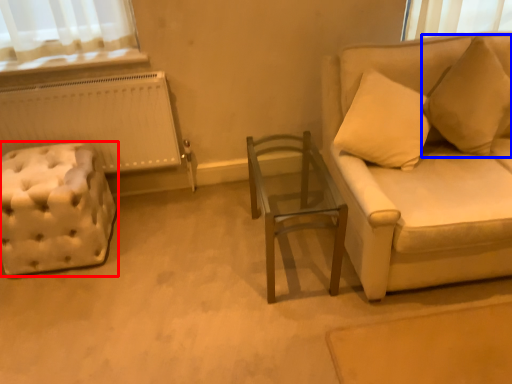
Question: Which object is further to the camera taking this photo, furniture (highlighted by a red box) or pillow (highlighted by a blue box)?

Choices:
 (A) furniture
 (B) pillow

Answer: (A)